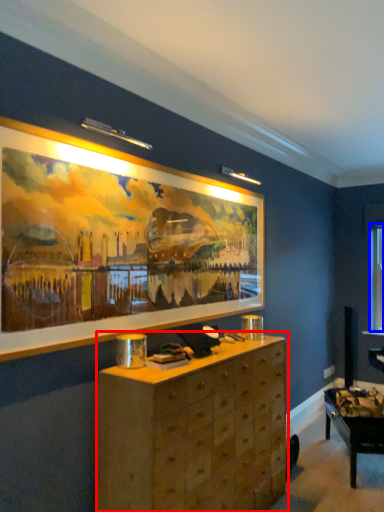
Question: Which point is further to the camera, chest of drawers (highlighted by a red box) or window (highlighted by a blue box)?

Choices:
 (A) chest of drawers
 (B) window

Answer: (B)